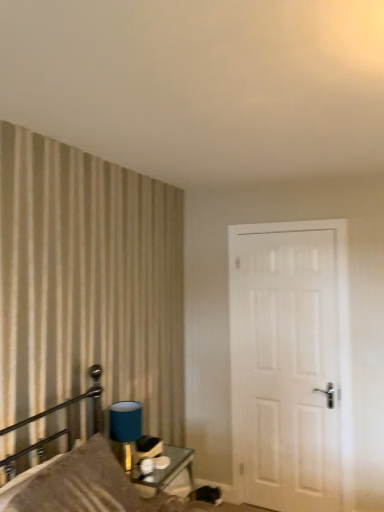
What do you see at coordinates (78, 484) in the screenshot? I see `textured beige pillow at left` at bounding box center [78, 484].

Describe the element at coordinates (78, 472) in the screenshot. I see `satin brown pillow at left` at that location.

Locate an element on the screen. blue fabric lampshade at upper left is located at coordinates (125, 429).

How many degrees apart are the facing directions of blue fabric lampshade at upper left and white matte door at right?

The angular difference between blue fabric lampshade at upper left and white matte door at right is 89.7 degrees.

Looking at this image, from a real-world perspective, is blue fabric lampshade at upper left physically below white matte door at right?

Yes, from a real-world perspective, blue fabric lampshade at upper left is beneath white matte door at right.

Which point is more distant from viewer, (123, 412) or (308, 285)?

The point (308, 285) is behind.

Between blue fabric lampshade at upper left and white matte door at right, which one is positioned in front?

blue fabric lampshade at upper left.

Is point (140, 435) closer or farther from the camera than point (174, 471)?

Clearly, point (140, 435) is closer to the camera than point (174, 471).

Which is in front, blue fabric lampshade at upper left or metallic glass table at lower center?

metallic glass table at lower center is in front.

Considering the relative sizes of blue fabric lampshade at upper left and metallic glass table at lower center in the image provided, is blue fabric lampshade at upper left thinner than metallic glass table at lower center?

Yes, blue fabric lampshade at upper left is thinner than metallic glass table at lower center.

Looking at this image, which of these two, blue fabric lampshade at upper left or metallic glass table at lower center, stands shorter?

Standing shorter between the two is blue fabric lampshade at upper left.

Based on the photo, from a real-world perspective, which object rests below the other?

From a 3D spatial view, textured beige pillow at left is below.

Are textured beige pillow at left and blue fabric lampshade at upper left beside each other?

No, textured beige pillow at left is not making contact with blue fabric lampshade at upper left.

From the image's perspective, which object appears higher, textured beige pillow at left or blue fabric lampshade at upper left?

blue fabric lampshade at upper left.

Is textured beige pillow at left facing away from blue fabric lampshade at upper left?

textured beige pillow at left is not turned away from blue fabric lampshade at upper left.

Does white matte door at right have a greater height compared to blue fabric lampshade at upper left?

Indeed, white matte door at right has a greater height compared to blue fabric lampshade at upper left.

Which of these two, white matte door at right or blue fabric lampshade at upper left, is wider?

blue fabric lampshade at upper left.

From a real-world perspective, is metallic glass table at lower center above or below satin brown pillow at left?

In terms of real-world spatial position, metallic glass table at lower center is below satin brown pillow at left.

Which is closer, (x=161, y=484) or (x=34, y=492)?

The point (x=34, y=492) is closer.

In terms of size, does metallic glass table at lower center appear bigger or smaller than satin brown pillow at left?

Clearly, metallic glass table at lower center is smaller in size than satin brown pillow at left.

Choose the correct answer: Is metallic glass table at lower center inside satin brown pillow at left or outside it?

metallic glass table at lower center exists outside the volume of satin brown pillow at left.

Where is `table below the blue fabric lampshade at upper left (from the image's perspective)`? The image size is (384, 512). table below the blue fabric lampshade at upper left (from the image's perspective) is located at coordinates (165, 470).

Is point (169, 449) positioned after point (120, 448)?

Yes, it is.

Based on the photo, do you think metallic glass table at lower center is within blue fabric lampshade at upper left, or outside of it?

metallic glass table at lower center is located beyond the bounds of blue fabric lampshade at upper left.

Between metallic glass table at lower center and blue fabric lampshade at upper left, which one appears on the left side from the viewer's perspective?

From the viewer's perspective, blue fabric lampshade at upper left appears more on the left side.

Could you tell me if metallic glass table at lower center is turned towards textured beige pillow at left?

No, metallic glass table at lower center is not oriented towards textured beige pillow at left.

Can we say metallic glass table at lower center lies outside textured beige pillow at left?

metallic glass table at lower center lies outside textured beige pillow at left's area.

Considering the sizes of objects metallic glass table at lower center and textured beige pillow at left in the image provided, who is bigger, metallic glass table at lower center or textured beige pillow at left?

textured beige pillow at left is bigger.

At what (x,y) coordinates should I click in order to perform the action: click on door positioned vertically above the blue fabric lampshade at upper left (from a real-world perspective). Please return your answer as a coordinate pair (x, y). Image resolution: width=384 pixels, height=512 pixels. Looking at the image, I should click on (291, 365).

At what (x,y) coordinates should I click in order to perform the action: click on table lamp to the left of metallic glass table at lower center. Please return your answer as a coordinate pair (x, y). The image size is (384, 512). Looking at the image, I should click on (125, 429).

Estimate the real-world distances between objects in this image. Which object is further from blue fabric lampshade at upper left, satin brown pillow at left or metallic glass table at lower center?

→ The object further to blue fabric lampshade at upper left is metallic glass table at lower center.

Considering their positions, is white matte door at right positioned further to textured beige pillow at left than metallic glass table at lower center?

white matte door at right lies further to textured beige pillow at left than the other object.

Considering their positions, is white matte door at right positioned closer to metallic glass table at lower center than blue fabric lampshade at upper left?

Based on the image, blue fabric lampshade at upper left appears to be nearer to metallic glass table at lower center.

Estimate the real-world distances between objects in this image. Which object is closer to metallic glass table at lower center, blue fabric lampshade at upper left or textured beige pillow at left?

Among the two, blue fabric lampshade at upper left is located nearer to metallic glass table at lower center.

In the scene shown: When comparing their distances from metallic glass table at lower center, does satin brown pillow at left or white matte door at right seem closer?

satin brown pillow at left is closer to metallic glass table at lower center.

Based on their spatial positions, is metallic glass table at lower center or satin brown pillow at left further from textured beige pillow at left?

Based on the image, metallic glass table at lower center appears to be further to textured beige pillow at left.

From the image, which object appears to be farther from satin brown pillow at left, white matte door at right or metallic glass table at lower center?

white matte door at right is positioned further to the anchor satin brown pillow at left.

When comparing their distances from white matte door at right, does metallic glass table at lower center or satin brown pillow at left seem further?

satin brown pillow at left is further to white matte door at right.

This screenshot has width=384, height=512. What are the coordinates of `table between textured beige pillow at left and white matte door at right from front to back` in the screenshot? It's located at (165, 470).

I want to click on pillow between satin brown pillow at left and metallic glass table at lower center in the front-back direction, so click(x=78, y=484).

Where is `table between blue fabric lampshade at upper left and white matte door at right in the horizontal direction`? The image size is (384, 512). table between blue fabric lampshade at upper left and white matte door at right in the horizontal direction is located at coordinates (165, 470).

At what (x,y) coordinates should I click in order to perform the action: click on pillow between satin brown pillow at left and white matte door at right from front to back. Please return your answer as a coordinate pair (x, y). Looking at the image, I should click on (78, 484).